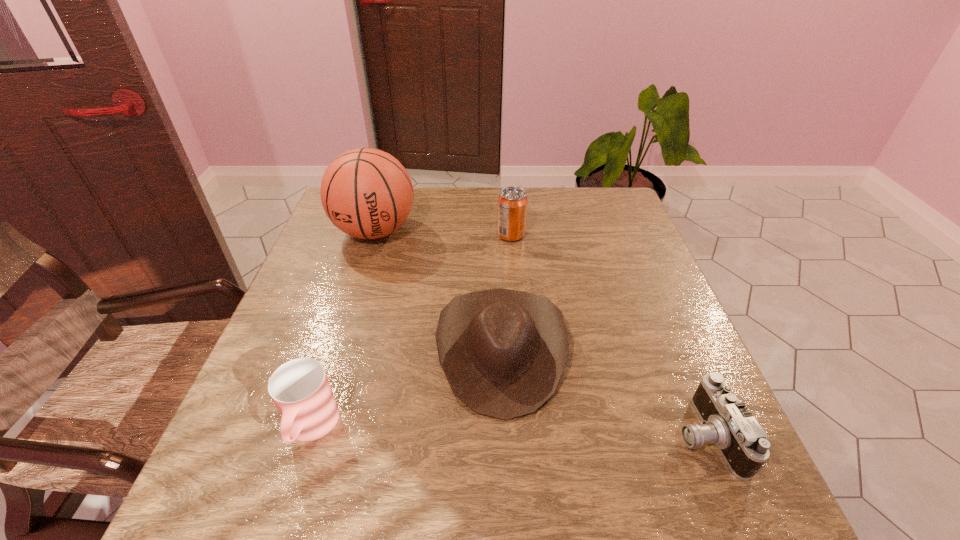
Where is `vacant area between the cup and the shortest object`? vacant area between the cup and the shortest object is located at coordinates (508, 432).

Find the location of a particular element. unoccupied area between the shortest object and the soda can is located at coordinates (608, 335).

Identify the location of empty space that is in between the cowboy hat and the tallest object. (438, 291).

Where is `free spot between the soda can and the tallest object`? This screenshot has width=960, height=540. free spot between the soda can and the tallest object is located at coordinates (443, 233).

In order to click on free space that is in between the soda can and the camera in this screenshot , I will do `click(608, 335)`.

The image size is (960, 540). I want to click on object that can be found as the second closest to the cup, so click(x=367, y=193).

This screenshot has width=960, height=540. Identify the location of object that is the third closest one to the basketball. (300, 389).

Where is `free space that satisfies the following two spatial constraints: 1. on the surface of the soda can near the brand logo; 2. on the left side of the tallest object`? This screenshot has width=960, height=540. free space that satisfies the following two spatial constraints: 1. on the surface of the soda can near the brand logo; 2. on the left side of the tallest object is located at coordinates click(x=373, y=235).

Locate an element on the screen. free space in the image that satisfies the following two spatial constraints: 1. on the surface of the tallest object near the brand logo; 2. on the left side of the cowboy hat is located at coordinates (338, 351).